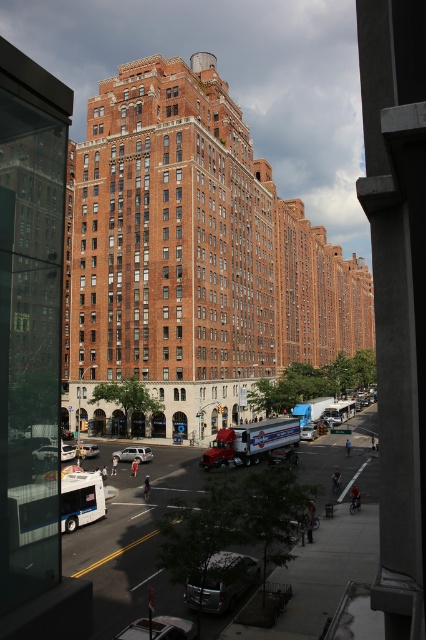
Question: Which object is closer to the camera taking this photo?

Choices:
 (A) metallic silver car at center
 (B) shiny silver car at lower left

Answer: (B)

Question: Is silver metallic sedan at center to the left of silver metallic car at center from the viewer's perspective?

Choices:
 (A) no
 (B) yes

Answer: (A)

Question: Is silver metallic van at lower center below silver metallic car at center?

Choices:
 (A) no
 (B) yes

Answer: (B)

Question: Which object is positioned farthest from the shiny silver car at lower left?

Choices:
 (A) metallic silver van at center
 (B) metallic silver car at lower left

Answer: (A)

Question: Can you confirm if silver metallic sedan at center is positioned below metallic silver van at center?

Choices:
 (A) no
 (B) yes

Answer: (A)

Question: Considering the real-world distances, which object is farthest from the metallic silver car at lower left?

Choices:
 (A) brick building at center
 (B) silver metallic van at lower center
 (C) metallic silver van at center

Answer: (A)